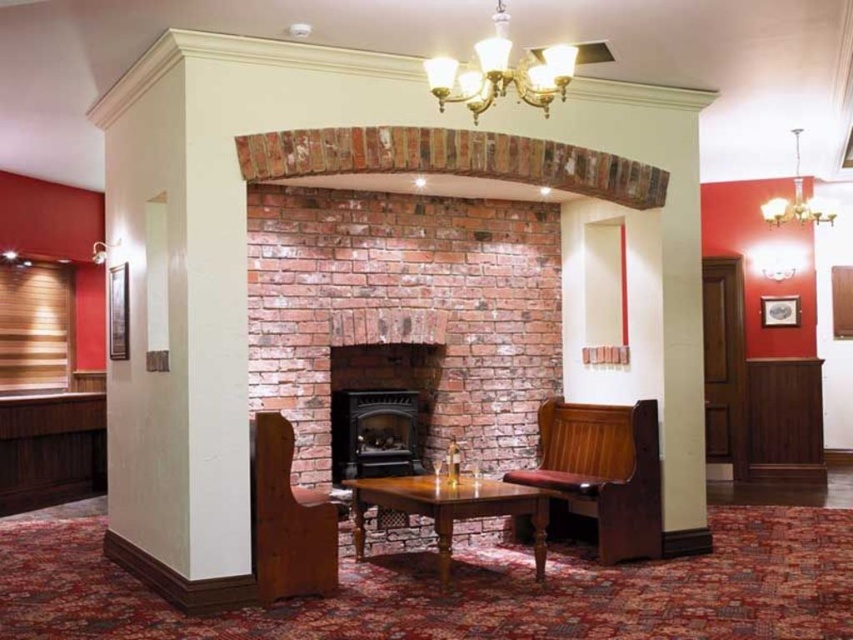
Question: Which object is the farthest from the polished wood bench at lower right?

Choices:
 (A) gold metallic chandelier at upper center
 (B) gold metallic chandelier at upper right
 (C) brown wood armchair at lower left
 (D) wooden table at center

Answer: (B)

Question: Which point appears closest to the camera in this image?

Choices:
 (A) (442, 76)
 (B) (328, 536)
 (C) (538, 506)
 (D) (592, 412)

Answer: (A)

Question: Which object is farther from the camera taking this photo?

Choices:
 (A) gold metallic chandelier at upper right
 (B) polished wood bench at lower right

Answer: (A)

Question: Does brown wood armchair at lower left have a larger size compared to gold metallic chandelier at upper right?

Choices:
 (A) no
 (B) yes

Answer: (A)

Question: Can you confirm if polished wood bench at lower right is positioned to the right of wooden table at center?

Choices:
 (A) no
 (B) yes

Answer: (B)

Question: Can you confirm if gold metallic chandelier at upper center is bigger than gold metallic chandelier at upper right?

Choices:
 (A) yes
 (B) no

Answer: (B)